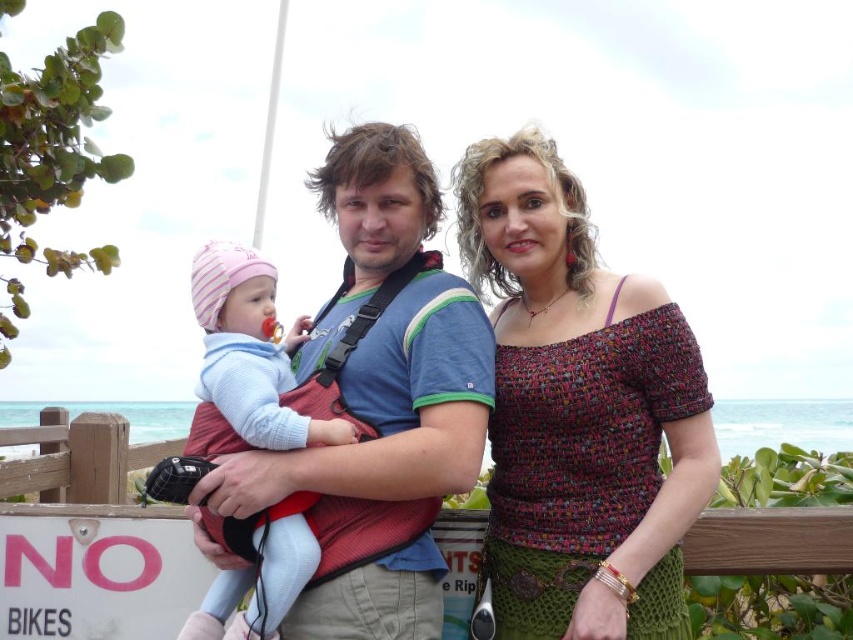
Question: Is the position of matte blue shirt at center less distant than that of light blue knit sweater at center?

Choices:
 (A) no
 (B) yes

Answer: (B)

Question: Which of the following is the closest to the observer?

Choices:
 (A) (273, 612)
 (B) (402, 620)
 (C) (675, 404)

Answer: (A)

Question: Can you confirm if multicolored woven top at center is positioned to the right of matte blue shirt at center?

Choices:
 (A) no
 (B) yes

Answer: (B)

Question: Does matte blue shirt at center have a larger size compared to light blue knit sweater at center?

Choices:
 (A) no
 (B) yes

Answer: (B)

Question: Among these points, which one is nearest to the camera?

Choices:
 (A) [577, 317]
 (B) [366, 452]

Answer: (B)

Question: Which point is farther to the camera?

Choices:
 (A) matte blue shirt at center
 (B) light blue knit sweater at center
 (C) multicolored woven top at center

Answer: (B)